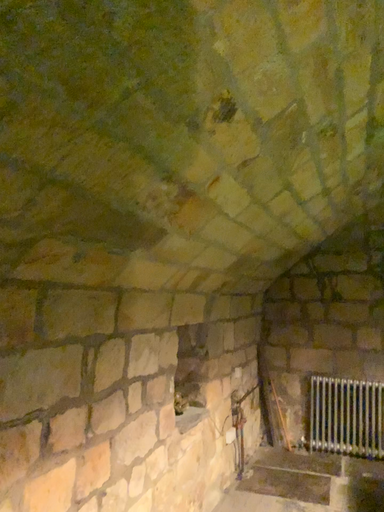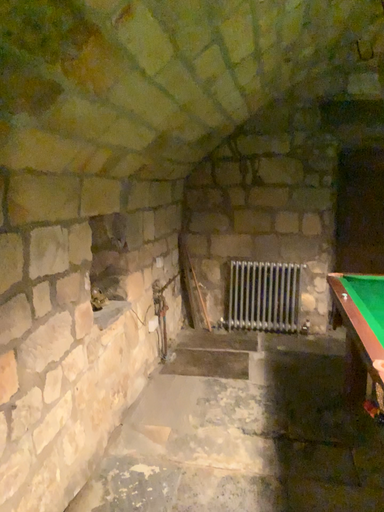
Question: How did the camera likely rotate when shooting the video?

Choices:
 (A) rotated right
 (B) rotated left

Answer: (A)